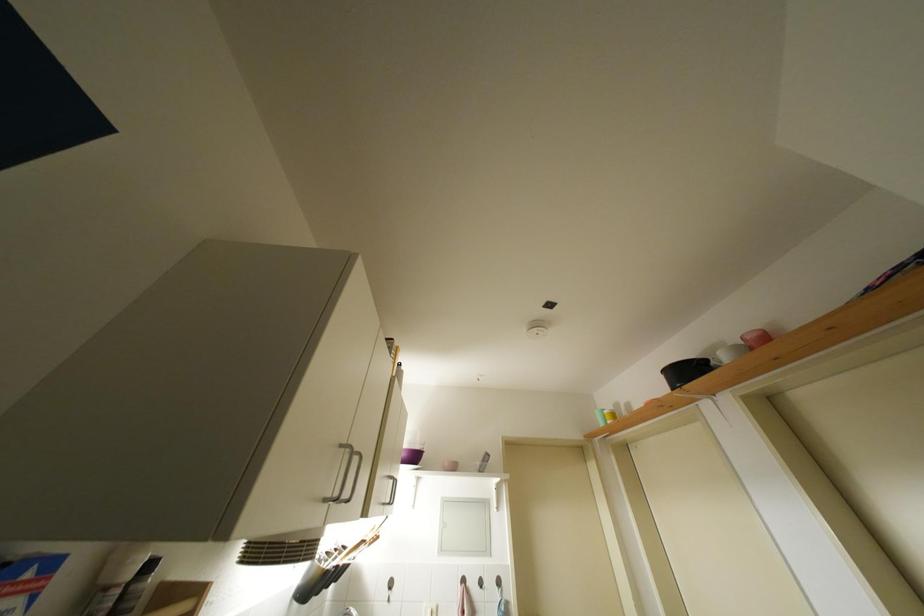
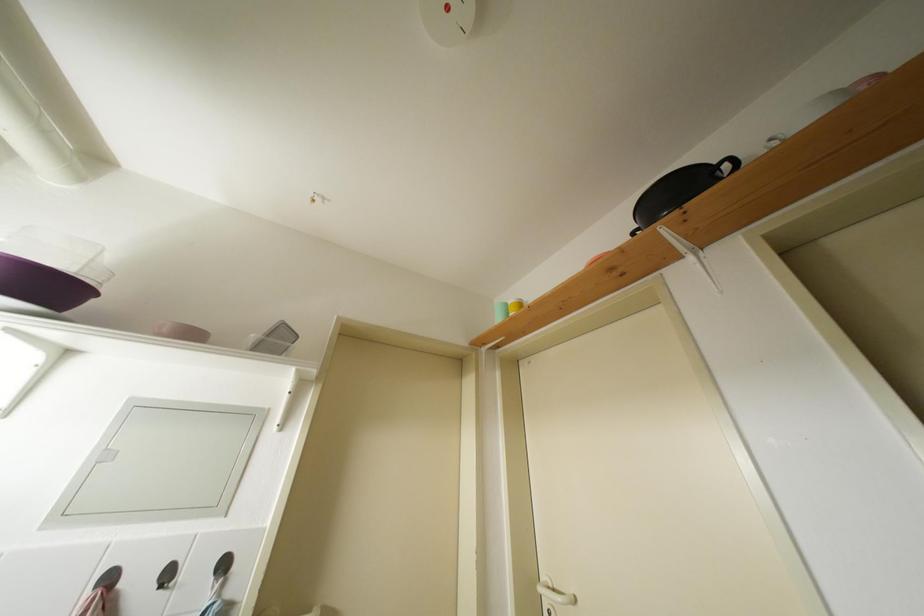
Which direction would the cameraman need to move to produce the second image?

The movement direction of the cameraman is right, forward.